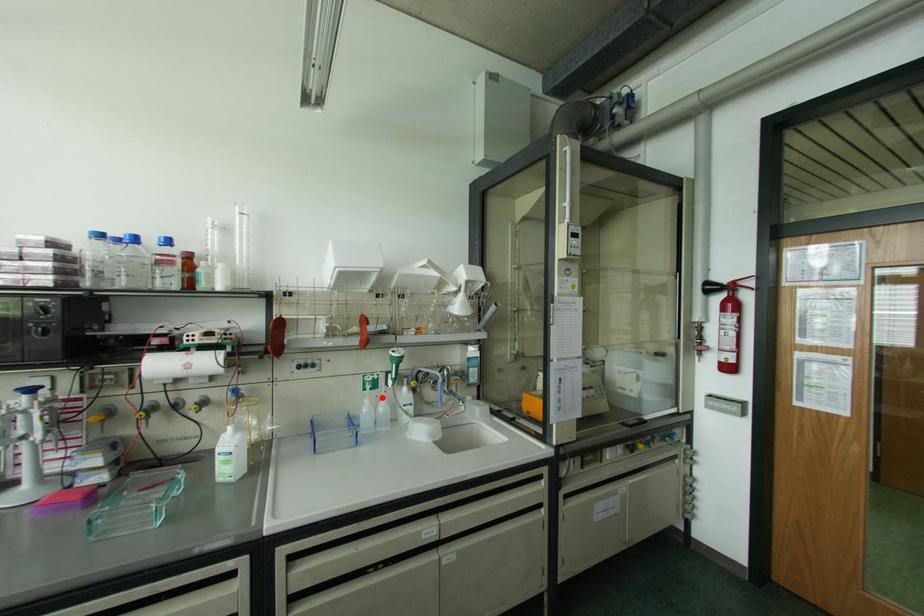
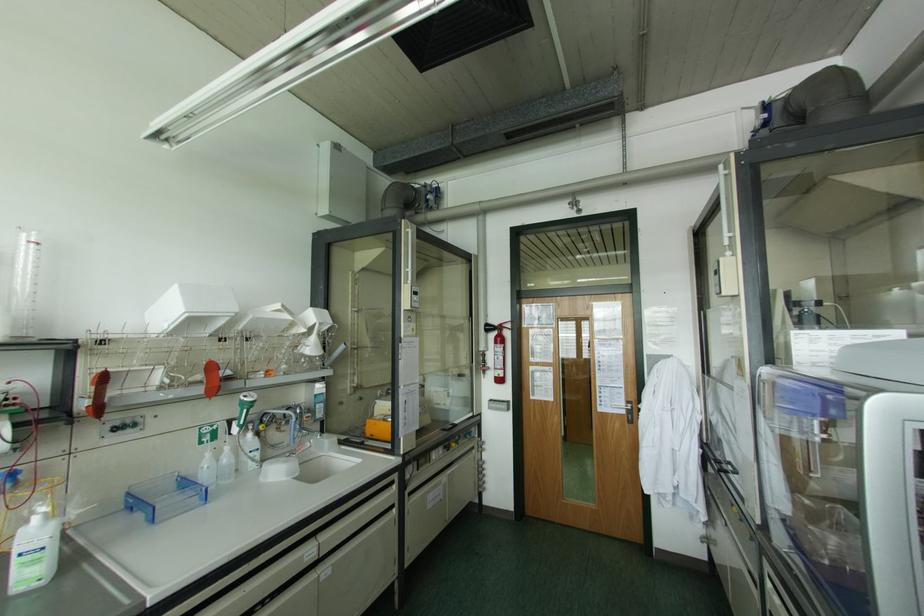
Question: I am providing you with two images of the same scene from different viewpoints. A red point is shown in image1. For the corresponding object point in image2, is it positioned nearer or farther from the camera?

Choices:
 (A) Nearer
 (B) Farther

Answer: (A)